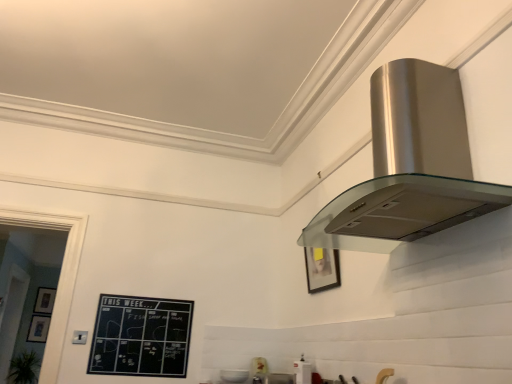
Question: From a real-world perspective, is matte black picture frame at lower left, the 2th picture frame viewed from the back, on top of matte white toaster at lower center, which appears as the third appliance when viewed from the front?

Choices:
 (A) yes
 (B) no

Answer: (A)

Question: Is matte black picture frame at lower left, acting as the 1th picture frame starting from the bottom, closer to the viewer compared to matte white toaster at lower center, placed as the 1th appliance when sorted from back to front?

Choices:
 (A) no
 (B) yes

Answer: (A)

Question: From the image's perspective, does matte black picture frame at lower left, the 2th picture frame viewed from the back, appear higher than matte white toaster at lower center, which appears as the third appliance when viewed from the front?

Choices:
 (A) yes
 (B) no

Answer: (B)

Question: Does matte black picture frame at lower left, the 2th picture frame viewed from the back, come behind matte white toaster at lower center, which is counted as the second appliance, starting from the left?

Choices:
 (A) no
 (B) yes

Answer: (B)

Question: Is matte black picture frame at lower left, the 3th picture frame viewed from the right, located outside matte white toaster at lower center, marked as the 2th appliance in a right-to-left arrangement?

Choices:
 (A) yes
 (B) no

Answer: (A)

Question: Would you say matte black picture frame at lower left, the 2th picture frame viewed from the back, contains matte white toaster at lower center, which appears as the third appliance when viewed from the front?

Choices:
 (A) no
 (B) yes

Answer: (A)

Question: Is satin silver range hood at upper right, the 3th appliance in the left-to-right sequence, outside of matte black picture frame at lower left, which ranks as the third picture frame in front-to-back order?

Choices:
 (A) no
 (B) yes

Answer: (B)

Question: Considering the relative sizes of satin silver range hood at upper right, the 3th appliance in the left-to-right sequence, and matte black picture frame at lower left, which appears as the 2th picture frame when viewed from the top, in the image provided, is satin silver range hood at upper right, the 3th appliance in the left-to-right sequence, thinner than matte black picture frame at lower left, which appears as the 2th picture frame when viewed from the top,?

Choices:
 (A) yes
 (B) no

Answer: (B)

Question: Would you consider satin silver range hood at upper right, the first appliance viewed from the front, to be distant from matte black picture frame at lower left, positioned as the first picture frame in back-to-front order?

Choices:
 (A) yes
 (B) no

Answer: (A)

Question: Are satin silver range hood at upper right, arranged as the 3th appliance when viewed from the back, and matte black picture frame at lower left, which appears as the 2th picture frame when viewed from the top, making contact?

Choices:
 (A) yes
 (B) no

Answer: (B)

Question: Is matte black picture frame at lower left, marked as the 2th picture frame in a bottom-to-top arrangement, at the back of satin silver range hood at upper right, the first appliance viewed from the front?

Choices:
 (A) yes
 (B) no

Answer: (B)

Question: Considering the relative sizes of satin silver range hood at upper right, the first appliance viewed from the front, and matte black picture frame at lower left, marked as the 2th picture frame in a bottom-to-top arrangement, in the image provided, is satin silver range hood at upper right, the first appliance viewed from the front, wider than matte black picture frame at lower left, marked as the 2th picture frame in a bottom-to-top arrangement,?

Choices:
 (A) yes
 (B) no

Answer: (A)

Question: From a real-world perspective, is satin silver range hood at upper right beneath matte black picture frame at lower left, placed as the 2th picture frame when sorted from front to back?

Choices:
 (A) no
 (B) yes

Answer: (A)